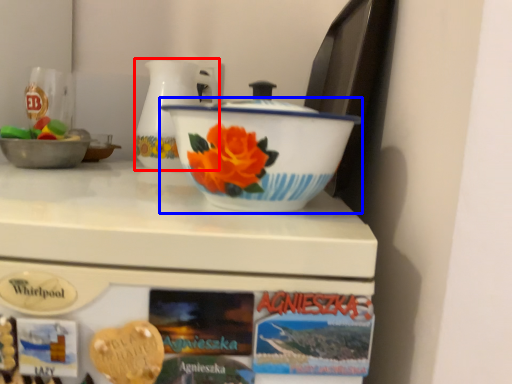
Question: Among these objects, which one is nearest to the camera, jug (highlighted by a red box) or basin (highlighted by a blue box)?

Choices:
 (A) jug
 (B) basin

Answer: (B)